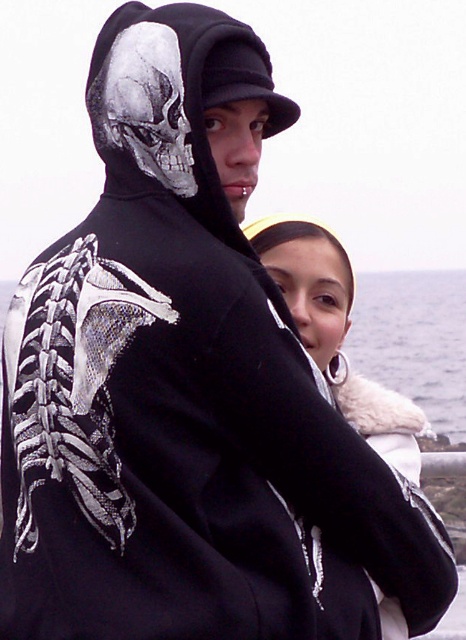
You are a fashion designer observing the two individuals. You need to decide which garment to recommend for a client who prefers items that are placed higher up. Which garment should you suggest between the smooth white fur at center and the gray matte skull at upper left?

The gray matte skull at upper left is positioned higher up than the smooth white fur at center, so you should recommend the gray matte skull at upper left.

You are an observer standing in front of the image. You see the smooth white fur at center and the gray matte skull at upper left. Which object is wider?

The smooth white fur at center is wider than the gray matte skull at upper left.